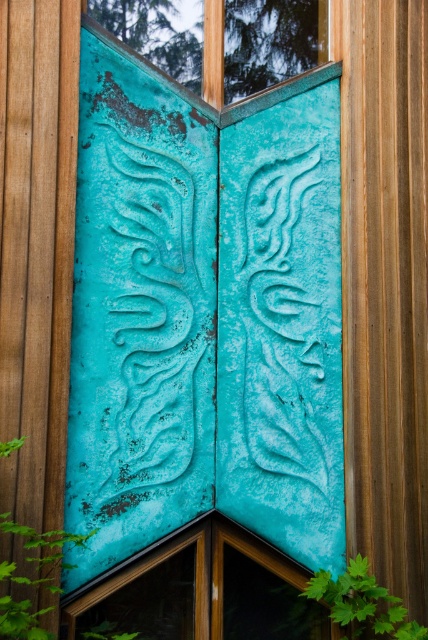
You are an architect designing a new building and want to incorporate similar elements. Given the scene, which object between the aqua patina door at center and the teal patina glass at upper center is wider?

The aqua patina door at center is wider than the teal patina glass at upper center.

You are an architect analyzing the decorative panels in the image. You notice two points marked on the structure. Which of the two points, point [199,561] or point [281,10], is positioned closer to the viewer?

Point [199,561] is closer to the camera than point [281,10].

You are a painter standing 8 feet away from the aqua patina door at center. Can you comfortably reach the door to paint it without needing a ladder?

The aqua patina door at center is 8.90 feet away from the viewer. Since you are standing 8 feet away, you are closer than the measured distance, so you can comfortably reach the door to paint it without a ladder.